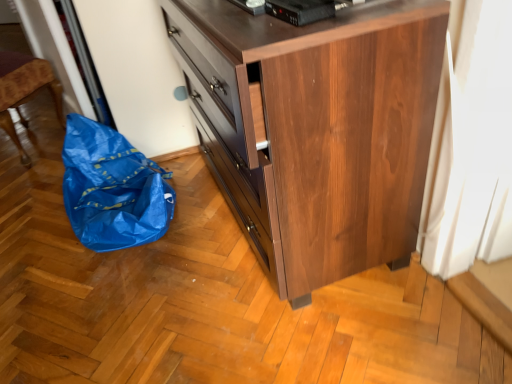
Identify the location of vacant space that is to the left of brown wood chest of drawers at center. This screenshot has height=384, width=512. (115, 285).